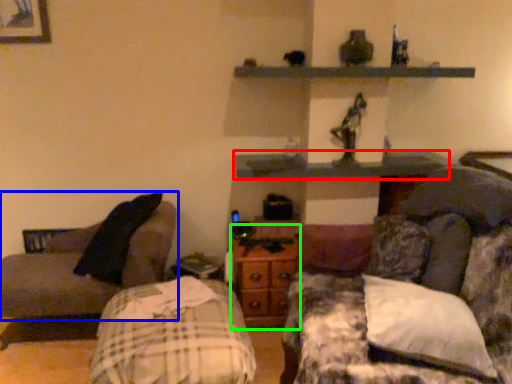
Question: Which is farther away from shelf (highlighted by a red box)? studio couch (highlighted by a blue box) or dresser (highlighted by a green box)?

Choices:
 (A) studio couch
 (B) dresser

Answer: (A)